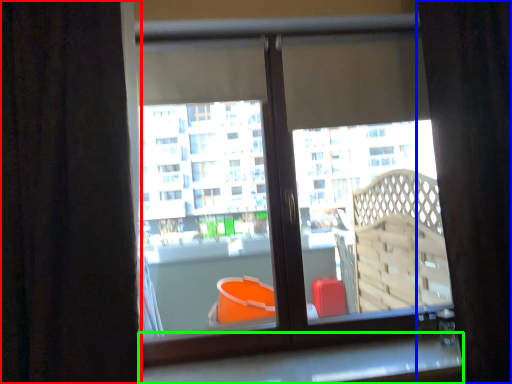
Question: Which object is the farthest from curtain (highlighted by a red box)? Choose among these: curtain (highlighted by a blue box) or window sill (highlighted by a green box).

Choices:
 (A) curtain
 (B) window sill

Answer: (A)